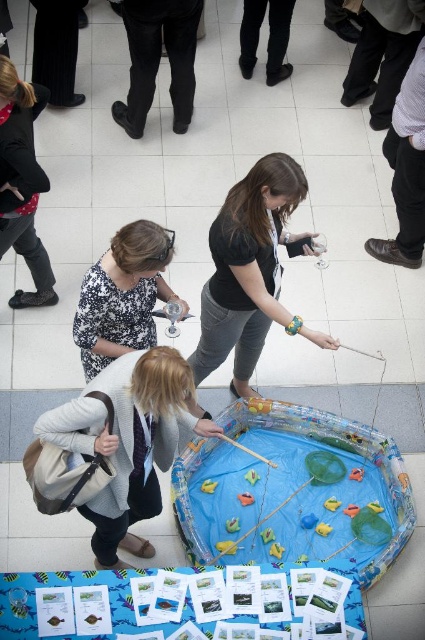
Question: Observing the image, what is the correct spatial positioning of floral fabric blouse at lower left in reference to black leather shoes at upper center?

Choices:
 (A) left
 (B) right

Answer: (A)

Question: In this image, where is black leather pants at upper center located relative to black leather shoes at upper center?

Choices:
 (A) above
 (B) below

Answer: (B)

Question: Which object appears farthest from the camera in this image?

Choices:
 (A) light gray sweater at center
 (B) floral fabric blouse at lower left
 (C) matte black shirt at upper left
 (D) brown leather shoe at lower right

Answer: (D)

Question: Which of the following is the farthest from the observer?

Choices:
 (A) floral fabric blouse at lower left
 (B) light gray sweater at center
 (C) black leather shoes at upper center
 (D) black matte shirt at center

Answer: (C)

Question: Which point is closer to the camera taking this photo?

Choices:
 (A) (130, 257)
 (B) (394, 154)

Answer: (A)

Question: Does black matte shirt at center have a greater width compared to floral fabric blouse at lower left?

Choices:
 (A) no
 (B) yes

Answer: (B)